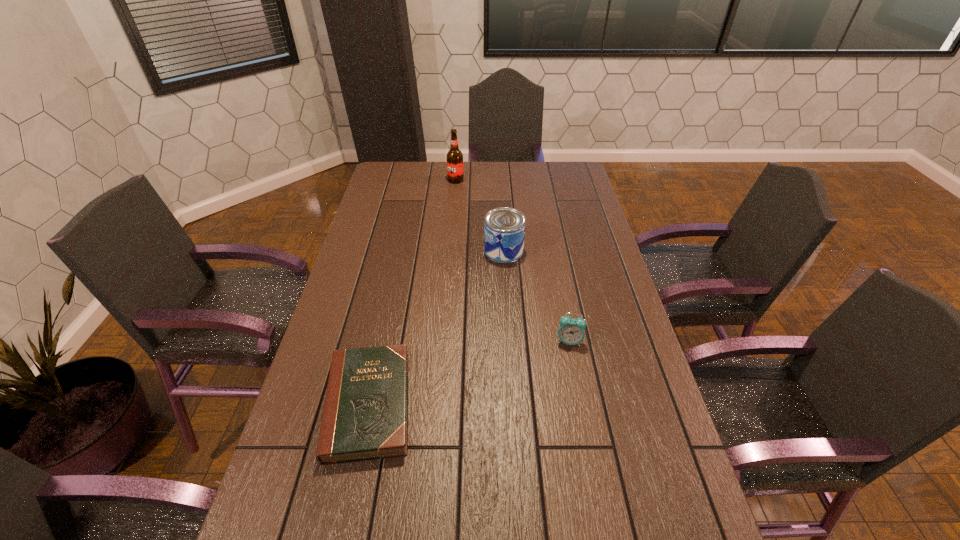
You are a GUI agent. You are given a task and a screenshot of the screen. Output one action in this format:
    pyautogui.click(x=<x>, y=<y>)
    Task: Click on the tallest object
    The image size is (960, 540).
    Given the screenshot: What is the action you would take?
    pyautogui.click(x=454, y=156)

In order to click on root beer in this screenshot , I will do `click(454, 156)`.

Identify the location of the third shortest object. 504,228.

At what (x,y) coordinates should I click in order to perform the action: click on the third object from left to right. Please return your answer as a coordinate pair (x, y). This screenshot has width=960, height=540. Looking at the image, I should click on (504, 228).

This screenshot has height=540, width=960. What are the coordinates of `alarm clock` in the screenshot? It's located at (571, 331).

Where is `the rightmost object`? The width and height of the screenshot is (960, 540). the rightmost object is located at coordinates (x=571, y=331).

Locate an element on the screen. Bible is located at coordinates (365, 416).

You are a GUI agent. You are given a task and a screenshot of the screen. Output one action in this format:
    pyautogui.click(x=<x>, y=<y>)
    Task: Click on the shortest object
    The height and width of the screenshot is (540, 960).
    Given the screenshot: What is the action you would take?
    pyautogui.click(x=365, y=416)

Where is `vacant point located on the left of the root beer`? The image size is (960, 540). vacant point located on the left of the root beer is located at coordinates (409, 180).

Locate an element on the screen. The image size is (960, 540). free space located 0.170m on the front label of the second tallest object is located at coordinates (436, 251).